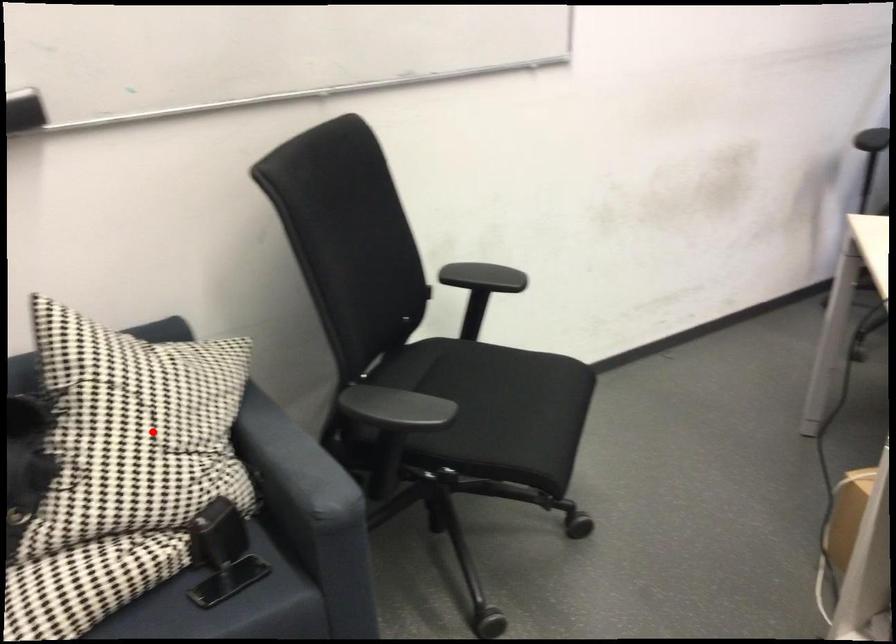
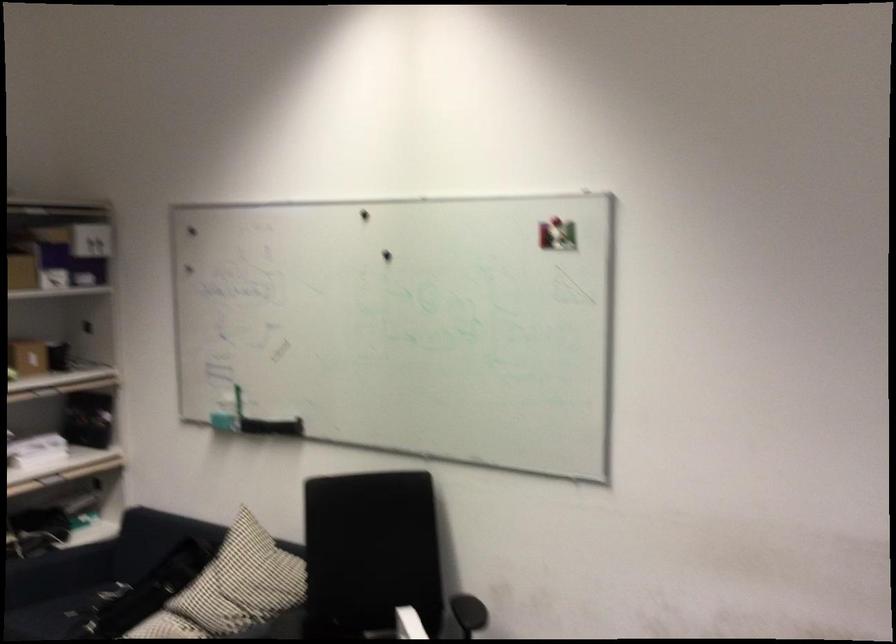
Question: A red point is marked in image1. In image2, is the corresponding 3D point closer to the camera or farther? Reply with the corresponding letter.

Choices:
 (A) The corresponding 3D point is closer.
 (B) The corresponding 3D point is farther.

Answer: (B)